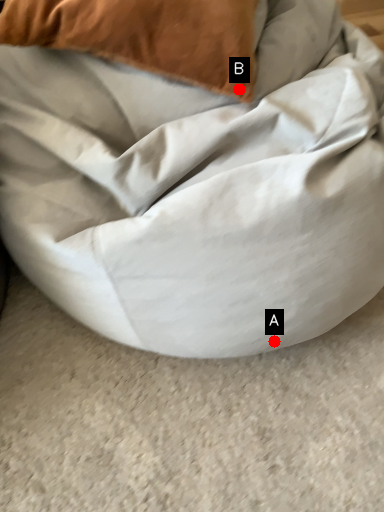
Question: Two points are circled on the image, labeled by A and B beside each circle. Which point is closer to the camera taking this photo?

Choices:
 (A) A is closer
 (B) B is closer

Answer: (A)